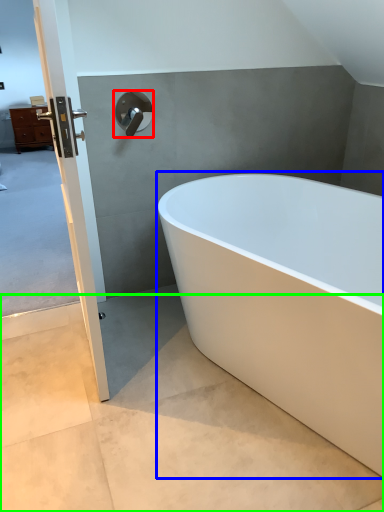
Question: Estimate the real-world distances between objects in this image. Which object is farther from tap (highlighted by a red box), bathtub (highlighted by a blue box) or concrete (highlighted by a green box)?

Choices:
 (A) bathtub
 (B) concrete

Answer: (B)